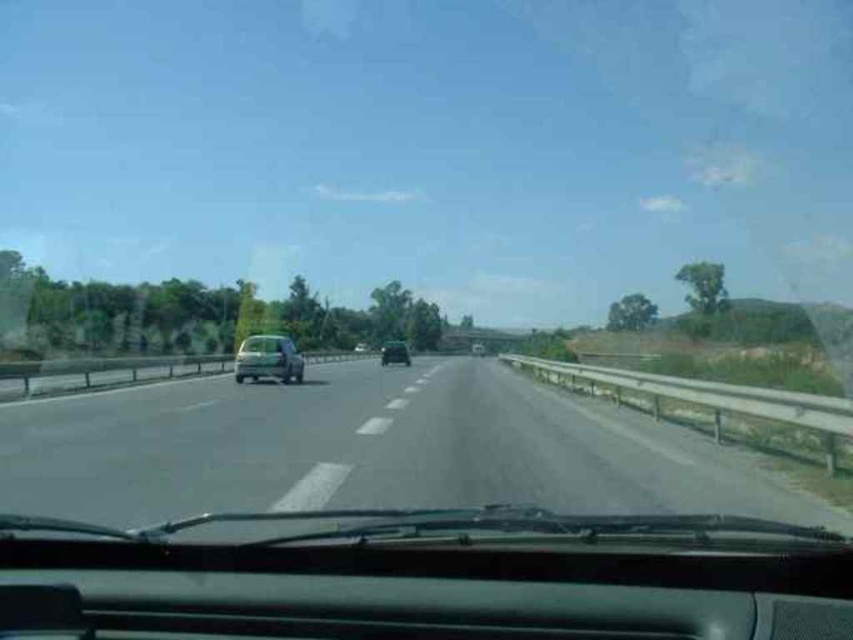
Question: Is asphalt road at center bigger than metallic silver car at left?

Choices:
 (A) no
 (B) yes

Answer: (B)

Question: Among these points, which one is farthest from the camera?

Choices:
 (A) (270, 369)
 (B) (358, 492)
 (C) (479, 355)
 (D) (390, 340)

Answer: (D)

Question: Which object is the farthest from the green matte car at center?

Choices:
 (A) metallic silver car at left
 (B) metallic silver sedan at center

Answer: (A)

Question: Can you confirm if metallic silver car at left is positioned to the right of metallic silver sedan at center?

Choices:
 (A) no
 (B) yes

Answer: (A)

Question: Which object is closer to the camera taking this photo?

Choices:
 (A) asphalt road at center
 (B) metallic silver car at left

Answer: (A)

Question: Can you confirm if asphalt road at center is smaller than green matte car at center?

Choices:
 (A) yes
 (B) no

Answer: (B)